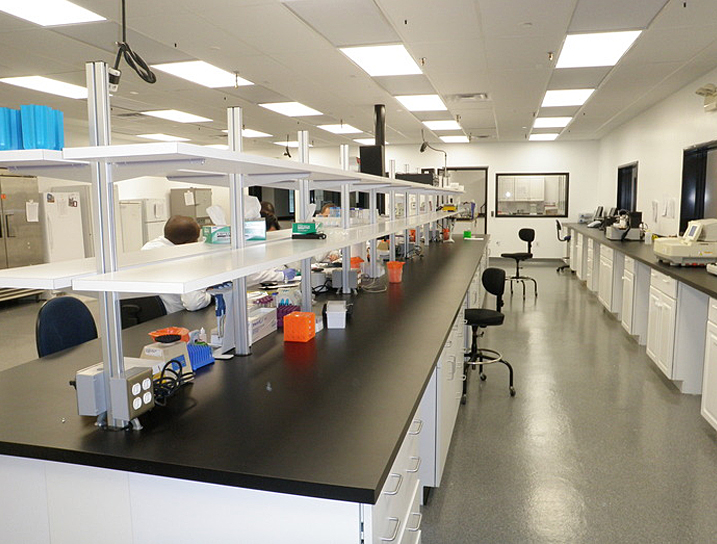
This screenshot has height=544, width=717. I want to click on the right wall, so click(663, 140).